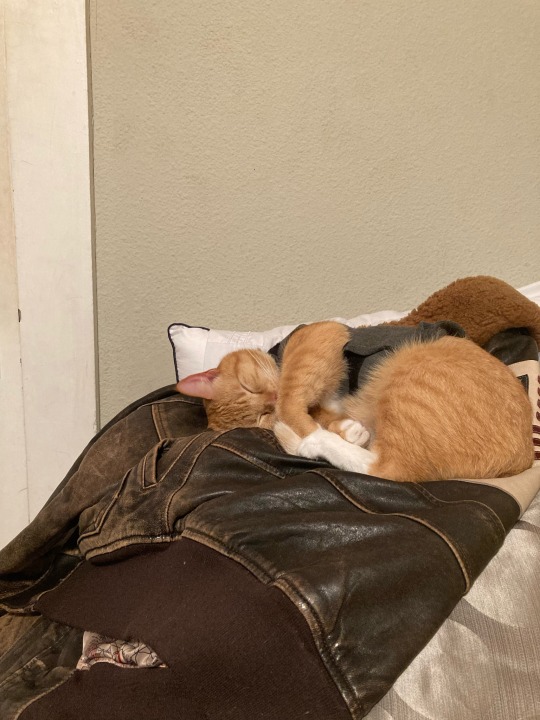
At what (x,y) coordinates should I click in order to perform the action: click on pillow. Please return your answer as a coordinate pair (x, y). Looking at the image, I should click on (207, 355).